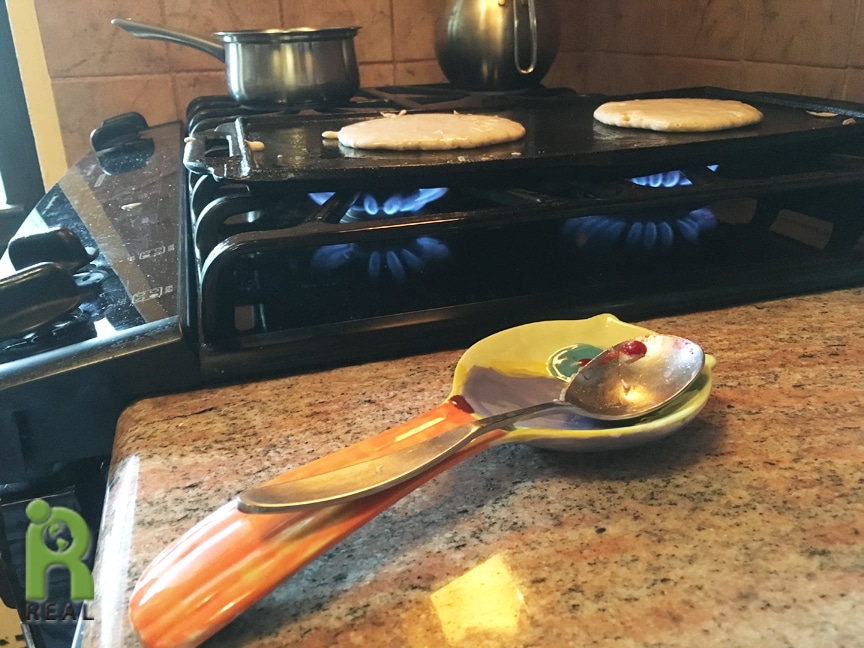
Locate instances of where you'd pickup the spoon in the image. Your answer should be formatted as a list of tuples, i.e. [(x1, y1), (x2, y2), ...], where each tuple contains the x and y coordinates of a point satisfying the conditions above.

[(446, 450)]